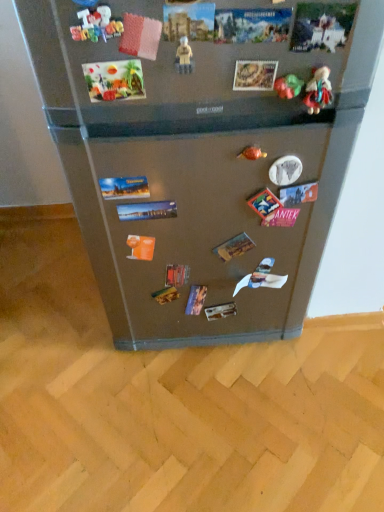
Question: From the image's perspective, is green matte toy at upper right, the fourth toy viewed from the front, under multicolored fabric doll at upper right, marked as the 1th toy in a right-to-left arrangement?

Choices:
 (A) no
 (B) yes

Answer: (B)

Question: Is green matte toy at upper right, which is counted as the second toy, starting from the back, oriented away from multicolored fabric doll at upper right, which is the third toy in front-to-back order?

Choices:
 (A) yes
 (B) no

Answer: (B)

Question: Is green matte toy at upper right, marked as the fourth toy in a left-to-right arrangement, smaller than multicolored fabric doll at upper right, arranged as the third toy when viewed from the back?

Choices:
 (A) no
 (B) yes

Answer: (B)

Question: From a real-world perspective, does green matte toy at upper right, marked as the fourth toy in a left-to-right arrangement, sit lower than multicolored fabric doll at upper right, which is the third toy in front-to-back order?

Choices:
 (A) no
 (B) yes

Answer: (A)

Question: Is green matte toy at upper right, marked as the fourth toy in a left-to-right arrangement, directly adjacent to multicolored fabric doll at upper right, which is the third toy in front-to-back order?

Choices:
 (A) no
 (B) yes

Answer: (B)

Question: Considering the positions of plastic beige figure at center, which appears as the 2th toy when viewed from the front, and green matte toy at upper right, marked as the 2th toy in a right-to-left arrangement, in the image, is plastic beige figure at center, which appears as the 2th toy when viewed from the front, taller or shorter than green matte toy at upper right, marked as the 2th toy in a right-to-left arrangement,?

Choices:
 (A) tall
 (B) short

Answer: (A)

Question: Is point (190, 69) positioned closer to the camera than point (286, 74)?

Choices:
 (A) closer
 (B) farther

Answer: (A)

Question: Is plastic beige figure at center, which appears as the 2th toy when viewed from the front, bigger or smaller than green matte toy at upper right, the fourth toy viewed from the front?

Choices:
 (A) big
 (B) small

Answer: (A)

Question: Considering their positions, is plastic beige figure at center, which is the 2th toy in left-to-right order, located in front of or behind green matte toy at upper right, the fourth toy viewed from the front?

Choices:
 (A) behind
 (B) front

Answer: (B)

Question: In terms of size, does multicolored fabric doll at upper right, the fifth toy viewed from the left, appear bigger or smaller than metallic gold ring at center, which appears as the fifth toy when viewed from the front?

Choices:
 (A) small
 (B) big

Answer: (B)

Question: Considering the positions of multicolored fabric doll at upper right, which is the third toy in front-to-back order, and metallic gold ring at center, which ranks as the first toy in back-to-front order, in the image, is multicolored fabric doll at upper right, which is the third toy in front-to-back order, taller or shorter than metallic gold ring at center, which ranks as the first toy in back-to-front order,?

Choices:
 (A) tall
 (B) short

Answer: (A)

Question: Is point (331, 93) positioned closer to the camera than point (244, 156)?

Choices:
 (A) farther
 (B) closer

Answer: (B)

Question: Choose the correct answer: Is multicolored fabric doll at upper right, arranged as the third toy when viewed from the back, inside metallic gold ring at center, arranged as the third toy when viewed from the right, or outside it?

Choices:
 (A) inside
 (B) outside

Answer: (B)

Question: From the image's perspective, relative to satin metallic fridge at center, is multicolored fabric doll at upper right, arranged as the third toy when viewed from the back, above or below?

Choices:
 (A) below
 (B) above

Answer: (B)

Question: Considering the positions of point (309, 98) and point (190, 257), is point (309, 98) closer or farther from the camera than point (190, 257)?

Choices:
 (A) closer
 (B) farther

Answer: (A)